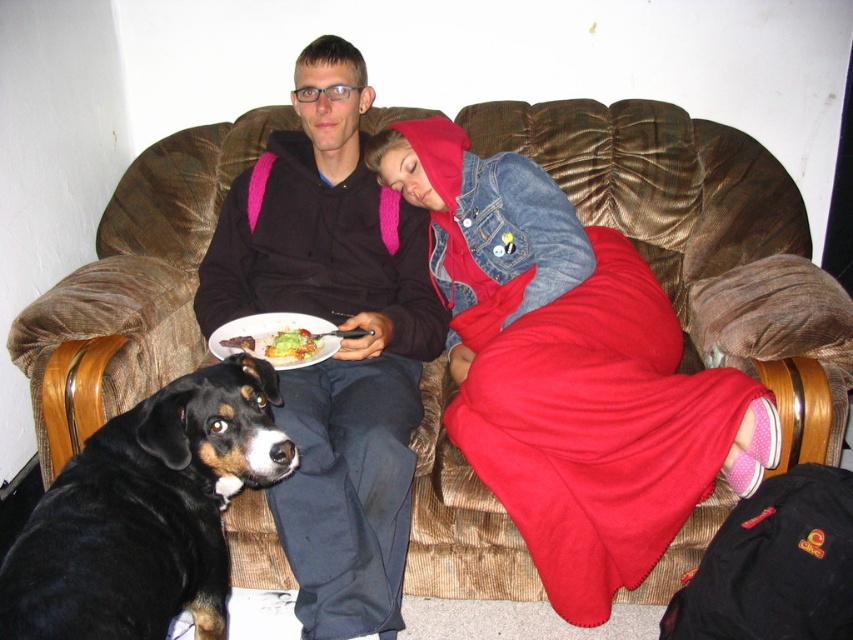
Is denim jacket at upper right shorter than black fur dog at lower left?

No, denim jacket at upper right is not shorter than black fur dog at lower left.

Which is more to the left, denim jacket at upper right or black fur dog at lower left?

Positioned to the left is black fur dog at lower left.

This screenshot has width=853, height=640. Describe the element at coordinates (569, 371) in the screenshot. I see `denim jacket at upper right` at that location.

Identify the location of denim jacket at upper right. The width and height of the screenshot is (853, 640). pyautogui.click(x=569, y=371).

Who is positioned more to the left, black fur dog at lower left or yellowish matte bread at center?

From the viewer's perspective, black fur dog at lower left appears more on the left side.

Locate an element on the screen. black fur dog at lower left is located at coordinates (148, 513).

Does matte black hoodie at center appear over yellowish matte bread at center?

Correct, matte black hoodie at center is located above yellowish matte bread at center.

Can you confirm if matte black hoodie at center is shorter than yellowish matte bread at center?

In fact, matte black hoodie at center may be taller than yellowish matte bread at center.

Is point (231, 260) farther from viewer compared to point (271, 355)?

Yes, point (231, 260) is farther from viewer.

You are a GUI agent. You are given a task and a screenshot of the screen. Output one action in this format:
    pyautogui.click(x=<x>, y=<y>)
    Task: Click on the matte black hoodie at center
    
    Given the screenshot: What is the action you would take?
    pyautogui.click(x=340, y=342)